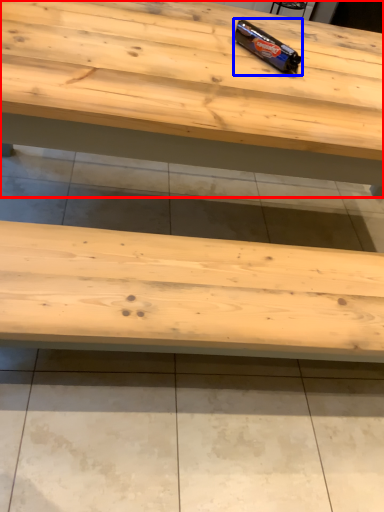
Question: Which point is further to the camera, table (highlighted by a red box) or chocolate bar (highlighted by a blue box)?

Choices:
 (A) table
 (B) chocolate bar

Answer: (B)